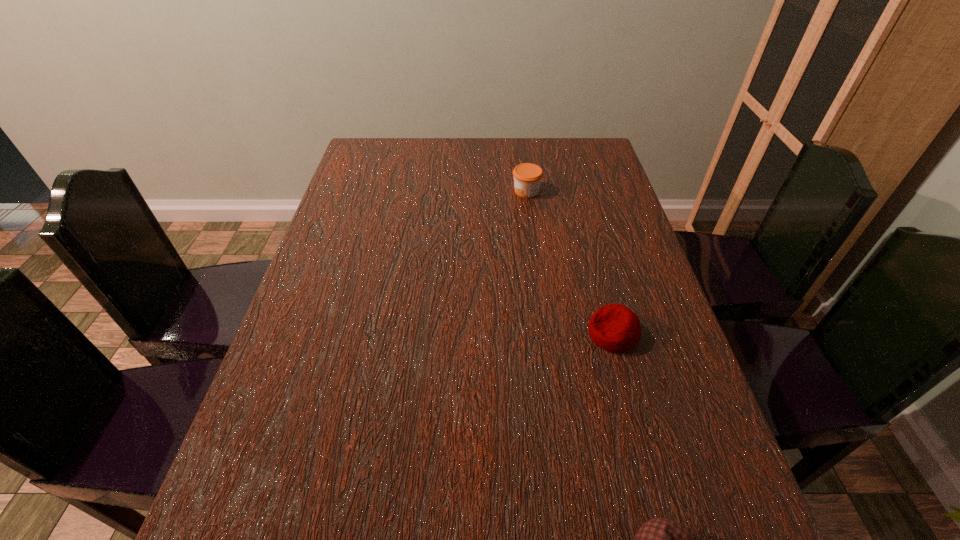
Locate an element on the screen. vacant region at the far edge of the desktop is located at coordinates (410, 144).

In the image, there is a desktop. What are the coordinates of `vacant area at the left edge` in the screenshot? It's located at (382, 186).

You are a GUI agent. You are given a task and a screenshot of the screen. Output one action in this format:
    pyautogui.click(x=<x>, y=<y>)
    Task: Click on the free location at the right edge of the desktop
    Image resolution: width=960 pixels, height=540 pixels.
    Given the screenshot: What is the action you would take?
    pyautogui.click(x=603, y=240)

This screenshot has width=960, height=540. Identify the location of free space at the far left corner of the desktop. (400, 160).

Image resolution: width=960 pixels, height=540 pixels. Identify the location of vacant area that lies between the leftmost object and the second nearest object. (569, 262).

I want to click on vacant area between the farther beanbag and the jam, so click(569, 262).

You are a GUI agent. You are given a task and a screenshot of the screen. Output one action in this format:
    pyautogui.click(x=<x>, y=<y>)
    Task: Click on the unoccupied area between the second nearest object and the farthest object
    Image resolution: width=960 pixels, height=540 pixels.
    Given the screenshot: What is the action you would take?
    pyautogui.click(x=569, y=262)

The height and width of the screenshot is (540, 960). I want to click on vacant area that lies between the farther beanbag and the leftmost object, so click(569, 262).

The image size is (960, 540). In order to click on object that ranks as the closest to the farther beanbag in this screenshot , I will do `click(660, 539)`.

This screenshot has height=540, width=960. I want to click on object that is the closest one to the farthest object, so click(615, 328).